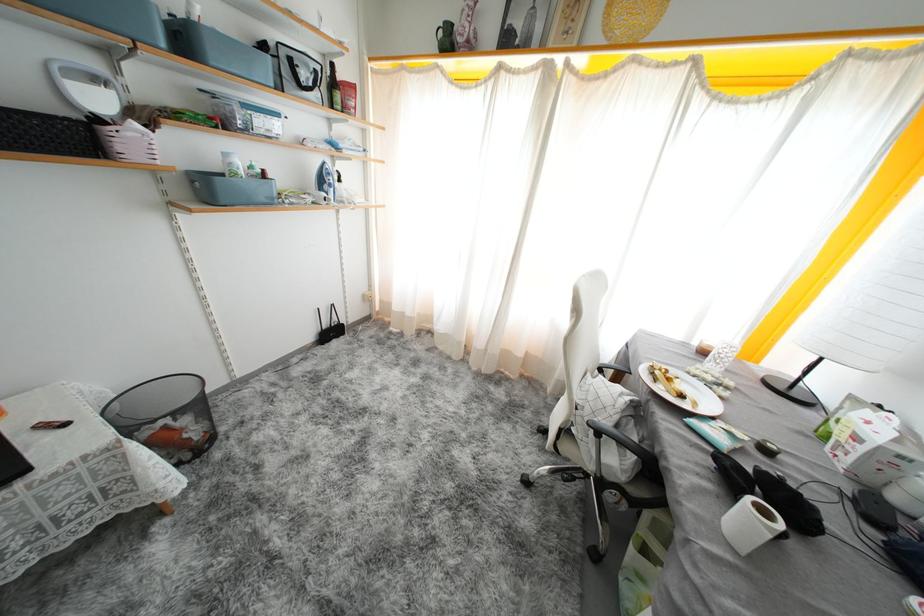
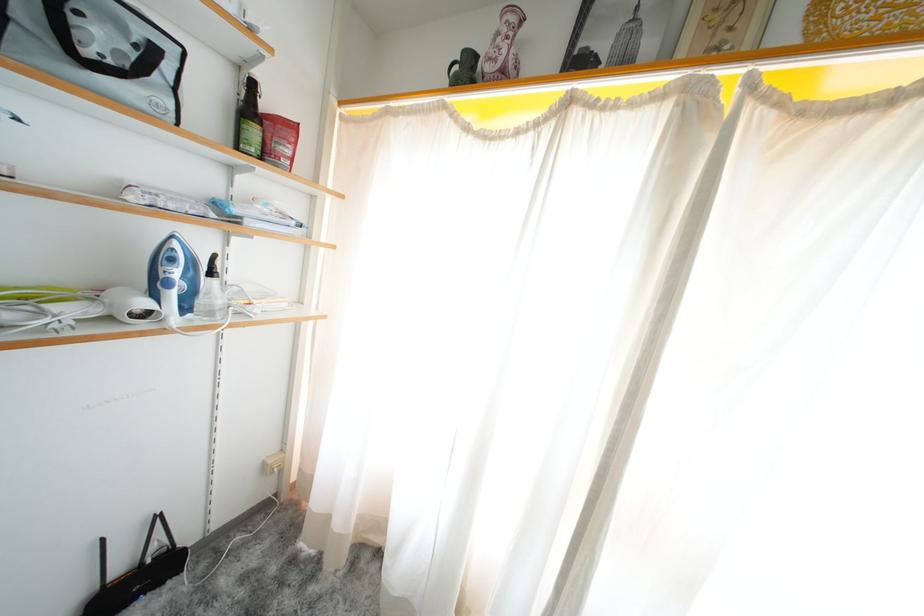
In the second image, find the point that corresponds to pixel 351 113 in the first image.

(273, 158)